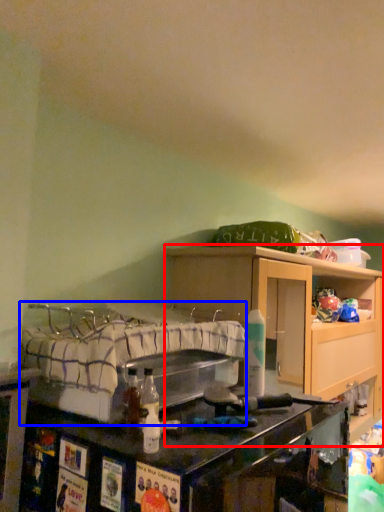
Question: Which of the following is the closest to the observer, cabinetry (highlighted by a red box) or bed (highlighted by a blue box)?

Choices:
 (A) cabinetry
 (B) bed

Answer: (B)